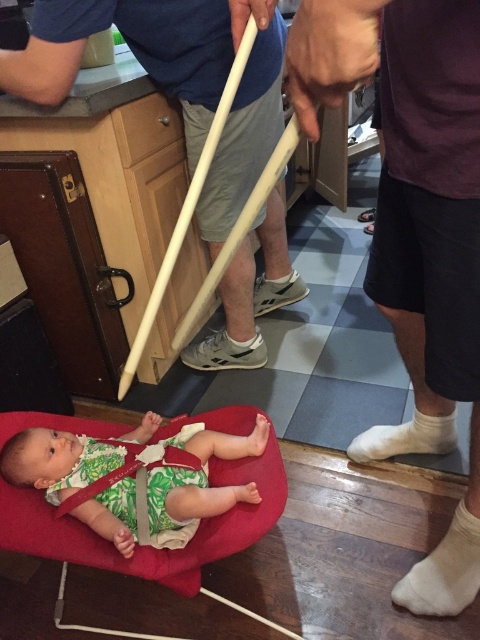
Which of these two, green leafy fabric baby at lower left or white cotton sock at lower right, stands taller?

Standing taller between the two is green leafy fabric baby at lower left.

Locate an element on the screen. green leafy fabric baby at lower left is located at coordinates (201, 477).

In order to click on green leafy fabric baby at lower left in this screenshot , I will do `click(201, 477)`.